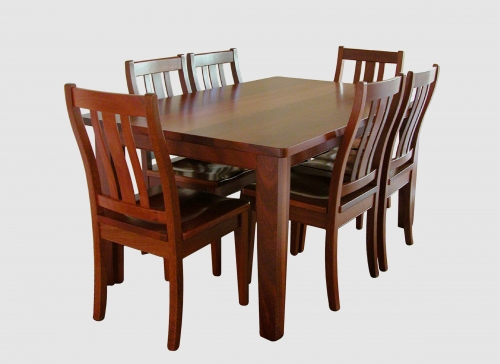
Identify the location of beams. (213, 71).